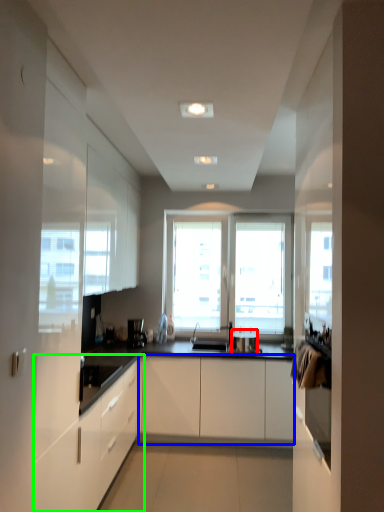
Question: Which is nearer to the appliance (highlighted by a red box)? cabinetry (highlighted by a blue box) or cabinetry (highlighted by a green box).

Choices:
 (A) cabinetry
 (B) cabinetry

Answer: (A)